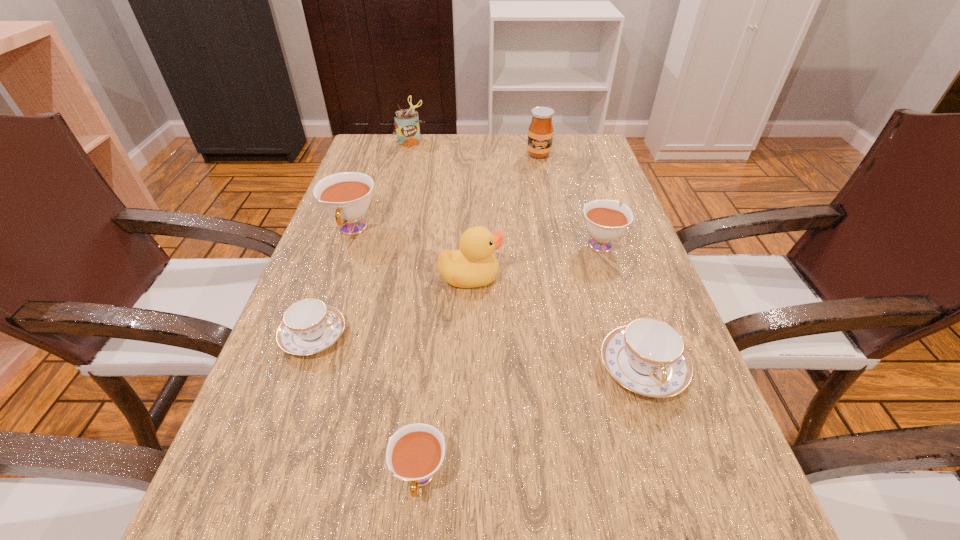
This screenshot has width=960, height=540. I want to click on vacant area that lies between the third teacup from right to left and the can, so click(415, 309).

Where is `the fourth closest object to the rightmost white teacup`? This screenshot has width=960, height=540. the fourth closest object to the rightmost white teacup is located at coordinates (346, 196).

Choose which object is the third nearest neighbor to the left blue teacup. Please provide its 2D coordinates. Your answer should be formatted as a tuple, i.e. [(x, y)], where the tuple contains the x and y coordinates of a point satisfying the conditions above.

[(414, 453)]

Locate which teacup is the closest to the second white teacup from right to left. Please provide its 2D coordinates. Your answer should be formatted as a tuple, i.e. [(x, y)], where the tuple contains the x and y coordinates of a point satisfying the conditions above.

[(309, 326)]

Identify which teacup is located as the fourth nearest to the can. Please provide its 2D coordinates. Your answer should be formatted as a tuple, i.e. [(x, y)], where the tuple contains the x and y coordinates of a point satisfying the conditions above.

[(648, 357)]

Select which white teacup is the second closest to the bigger blue teacup. Please provide its 2D coordinates. Your answer should be formatted as a tuple, i.e. [(x, y)], where the tuple contains the x and y coordinates of a point satisfying the conditions above.

[(414, 453)]

Locate an element on the screen. The width and height of the screenshot is (960, 540). the second closest white teacup to the honey is located at coordinates (346, 196).

Locate which blue teacup is the second closest to the fifth farthest object. Please provide its 2D coordinates. Your answer should be formatted as a tuple, i.e. [(x, y)], where the tuple contains the x and y coordinates of a point satisfying the conditions above.

[(648, 357)]

Where is `the closest blue teacup to the biggest white teacup`? The height and width of the screenshot is (540, 960). the closest blue teacup to the biggest white teacup is located at coordinates (309, 326).